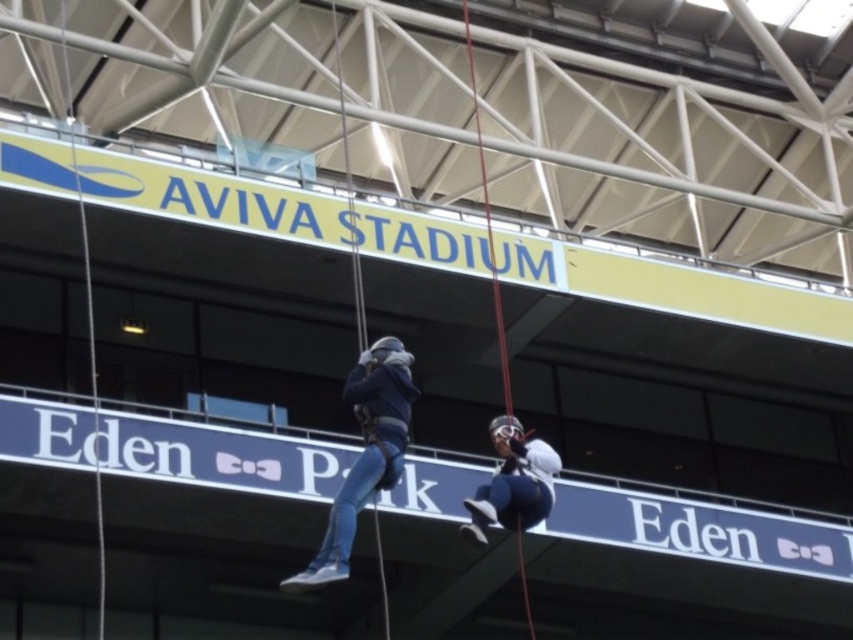
You are a safety inspector reviewing the rappelling setup at the Aviva Stadium. You notice a point marked at coordinates (x=364, y=452). What object is located at this point?

The point at coordinates (x=364, y=452) corresponds to blue denim jeans at center.

You are a safety inspector assessing the rappelling setup. You notice the blue denim jeans at center and the white matte helmet at center. Based on their positions, which object could potentially block the other person from seeing the ropes below?

The blue denim jeans at center might be wider than the white matte helmet at center, so it could block the view of the ropes below if positioned in front.

You are a safety inspector assessing the rappelling setup at the Aviva Stadium. You notice two points marked on the building wall. Which point is closer to you, point at coordinates (367, 499) or point at coordinates (479, 541)?

Point at coordinates (367, 499) is closer to the viewer than point at coordinates (479, 541).